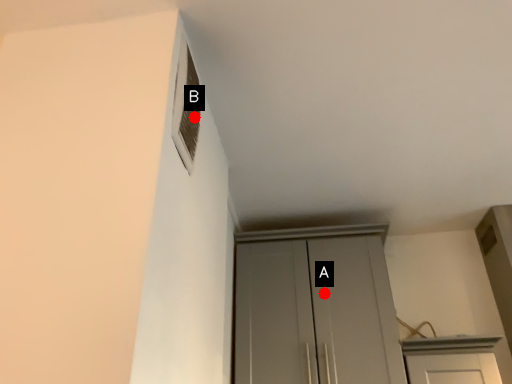
Question: Two points are circled on the image, labeled by A and B beside each circle. Which point appears farthest from the camera in this image?

Choices:
 (A) A is further
 (B) B is further

Answer: (A)